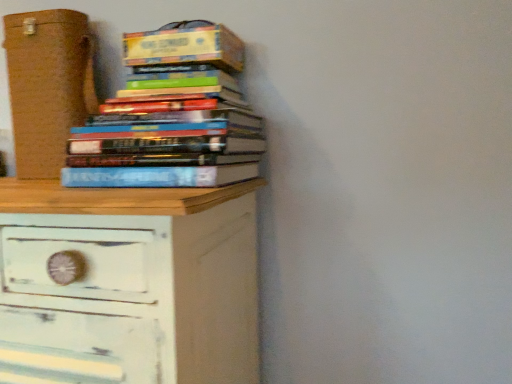
Question: Is hardcover books at upper center further to camera compared to hardcover book at upper left?

Choices:
 (A) no
 (B) yes

Answer: (A)

Question: Considering the relative positions of hardcover books at upper center and hardcover book at upper left in the image provided, is hardcover books at upper center in front of hardcover book at upper left?

Choices:
 (A) no
 (B) yes

Answer: (B)

Question: Is hardcover books at upper center smaller than hardcover book at upper left?

Choices:
 (A) no
 (B) yes

Answer: (A)

Question: Is hardcover books at upper center turned away from hardcover book at upper left?

Choices:
 (A) yes
 (B) no

Answer: (B)

Question: Is hardcover books at upper center completely or partially outside of hardcover book at upper left?

Choices:
 (A) yes
 (B) no

Answer: (A)

Question: Is hardcover books at upper center to the right of hardcover book at upper left from the viewer's perspective?

Choices:
 (A) no
 (B) yes

Answer: (A)

Question: From the image's perspective, is brown cardboard box at left under hardcover book at upper left?

Choices:
 (A) yes
 (B) no

Answer: (A)

Question: From a real-world perspective, is brown cardboard box at left on hardcover book at upper left?

Choices:
 (A) no
 (B) yes

Answer: (A)

Question: Is brown cardboard box at left positioned far away from hardcover book at upper left?

Choices:
 (A) no
 (B) yes

Answer: (A)

Question: Can you confirm if brown cardboard box at left is shorter than hardcover book at upper left?

Choices:
 (A) no
 (B) yes

Answer: (A)

Question: Can you confirm if brown cardboard box at left is taller than hardcover book at upper left?

Choices:
 (A) yes
 (B) no

Answer: (A)

Question: Is brown cardboard box at left closer to camera compared to hardcover book at upper left?

Choices:
 (A) no
 (B) yes

Answer: (A)

Question: Is hardcover book at upper left with white distressed wood chest of drawers at lower left?

Choices:
 (A) yes
 (B) no

Answer: (B)